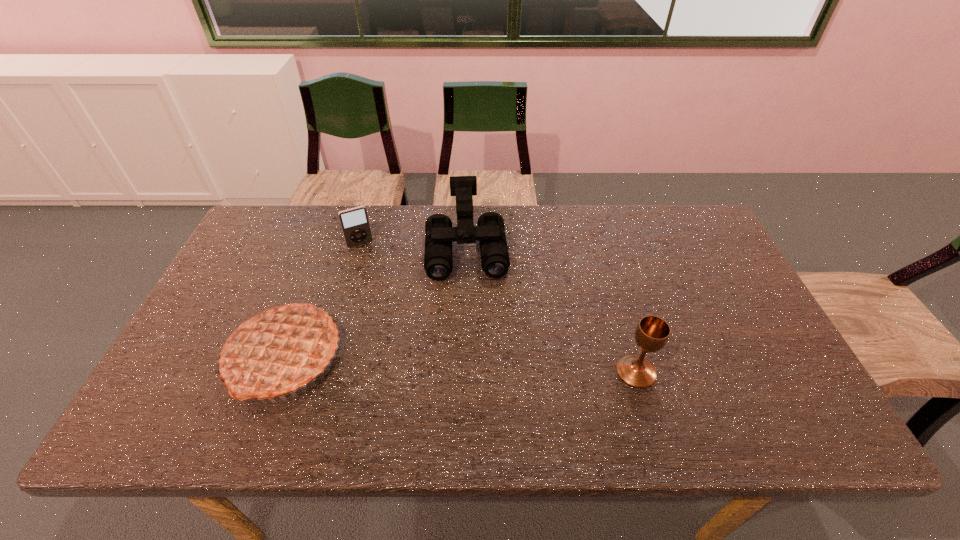
In the image, there is a desktop. Where is `vacant region at the left edge`? vacant region at the left edge is located at coordinates (232, 274).

Identify the location of free space at the right edge. pos(725,328).

You are a GUI agent. You are given a task and a screenshot of the screen. Output one action in this format:
    pyautogui.click(x=<x>, y=<y>)
    Task: Click on the free region at the far left corner
    
    Given the screenshot: What is the action you would take?
    (266, 235)

In the image, there is a desktop. Where is `vacant space at the near left corner`? Image resolution: width=960 pixels, height=540 pixels. vacant space at the near left corner is located at coordinates 166,388.

Identify the location of free space between the chalice and the binoculars. (551, 310).

At what (x,y) coordinates should I click in order to perform the action: click on free space between the tallest object and the shortest object. Please return your answer as a coordinate pair (x, y). Image resolution: width=960 pixels, height=540 pixels. Looking at the image, I should click on (323, 301).

The height and width of the screenshot is (540, 960). I want to click on free space between the chalice and the iPod, so click(498, 308).

Find the location of a particular element. This screenshot has width=960, height=540. free space between the binoculars and the chalice is located at coordinates (551, 310).

You are a GUI agent. You are given a task and a screenshot of the screen. Output one action in this format:
    pyautogui.click(x=<x>, y=<y>)
    Task: Click on the vacant region between the tallest object and the binoculars
    The height and width of the screenshot is (540, 960).
    Given the screenshot: What is the action you would take?
    pyautogui.click(x=375, y=303)

Where is `free point between the pie and the rightmost object`? The width and height of the screenshot is (960, 540). free point between the pie and the rightmost object is located at coordinates (461, 364).